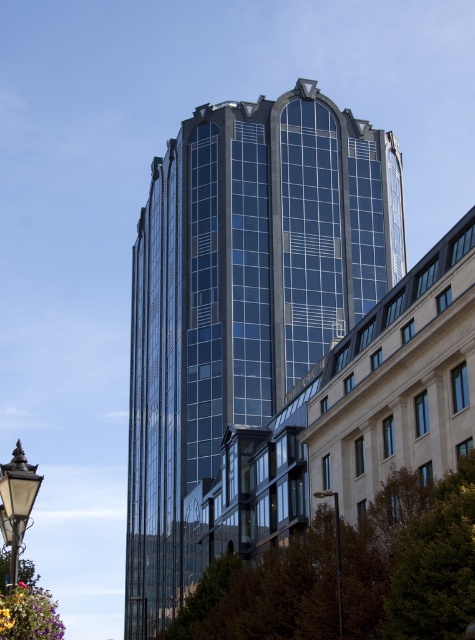
Is point (12, 550) behind point (341, 586)?

No, (12, 550) is in front of (341, 586).

Can you confirm if black glass lamp post at lower left is shorter than black glass lamp post at lower right?

No.

The width and height of the screenshot is (475, 640). Describe the element at coordinates (17, 504) in the screenshot. I see `black glass lamp post at lower left` at that location.

This screenshot has height=640, width=475. I want to click on black glass lamp post at lower left, so click(17, 504).

Can you confirm if glassy blue skyscraper at center is positioned to the right of black glass lamp post at lower right?

Incorrect, glassy blue skyscraper at center is not on the right side of black glass lamp post at lower right.

Is glassy blue skyscraper at center positioned in front of black glass lamp post at lower right?

That is False.

This screenshot has height=640, width=475. I want to click on glassy blue skyscraper at center, so click(x=240, y=307).

In order to click on glassy blue skyscraper at center in this screenshot , I will do `click(240, 307)`.

Is point (243, 394) positioned after point (19, 486)?

Yes, it is.

Between point (265, 188) and point (10, 544), which one is positioned behind?

Positioned behind is point (265, 188).

What do you see at coordinates (240, 307) in the screenshot?
I see `glassy blue skyscraper at center` at bounding box center [240, 307].

This screenshot has width=475, height=640. Identify the location of glassy blue skyscraper at center. (240, 307).